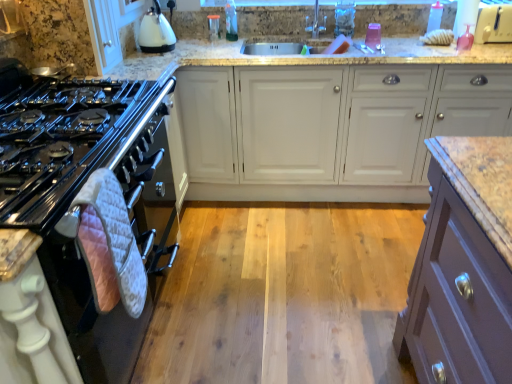
Question: From a real-world perspective, is white quilted oven mitt at left positioned above or below white glossy kettle at upper left?

Choices:
 (A) below
 (B) above

Answer: (A)

Question: Is white quilted oven mitt at left wider or thinner than white glossy kettle at upper left?

Choices:
 (A) wide
 (B) thin

Answer: (A)

Question: Estimate the real-world distances between objects in this image. Which object is closer to the white plastic toaster at upper right, which is the second appliance in back-to-front order?

Choices:
 (A) white quilted oven mitt at left
 (B) translucent plastic bottle at upper center, marked as the first bottle in a left-to-right arrangement
 (C) clear glass container at upper center, which ranks as the 1th appliance in left-to-right order
 (D) black glossy gas stove at left
 (E) white glossy kettle at upper left

Answer: (B)

Question: Estimate the real-world distances between objects in this image. Which object is closer to the white glossy kettle at upper left?

Choices:
 (A) clear glass container at upper center, placed as the 1th appliance when sorted from back to front
 (B) black glossy gas stove at left
 (C) translucent plastic bottle at upper center, marked as the first bottle in a left-to-right arrangement
 (D) white matte cabinet at center
 (E) transparent plastic bottle at upper right, the first bottle positioned from the right

Answer: (A)